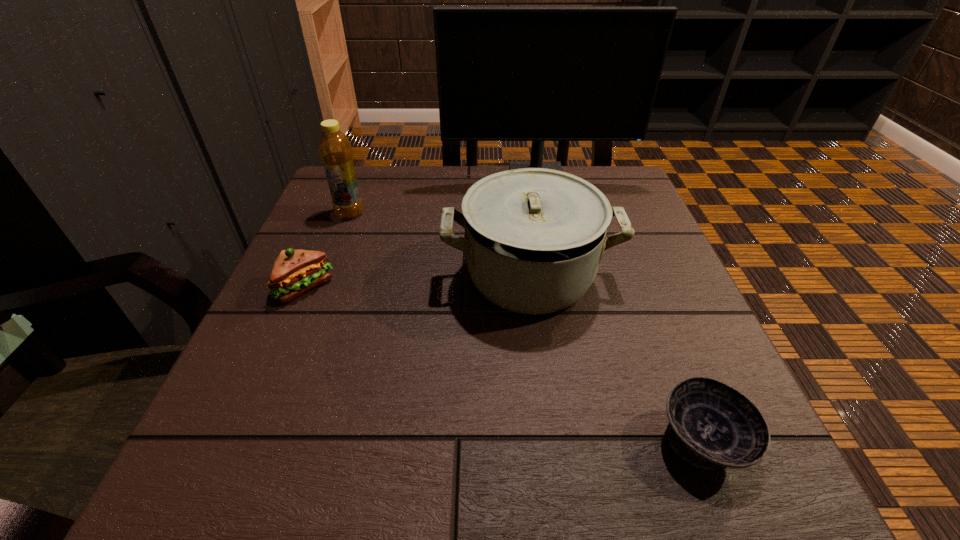
This screenshot has width=960, height=540. Find the location of `free space located 0.270m on the left of the third shortest object`. free space located 0.270m on the left of the third shortest object is located at coordinates (309, 276).

Where is `vacant area located on the back of the sandwich`? vacant area located on the back of the sandwich is located at coordinates (349, 183).

At what (x,y) coordinates should I click in order to perform the action: click on vacant space located 0.090m on the back of the nearest object. Please return your answer as a coordinate pair (x, y). Looking at the image, I should click on (668, 354).

Where is `computer monitor that is at the far edge`? This screenshot has width=960, height=540. computer monitor that is at the far edge is located at coordinates pyautogui.click(x=538, y=74).

What are the coordinates of `bottle that is positioned at the far edge` in the screenshot? It's located at (335, 150).

Where is `object that is at the near edge`? This screenshot has height=540, width=960. object that is at the near edge is located at coordinates (711, 425).

You are a GUI agent. You are given a task and a screenshot of the screen. Output one action in this format:
    pyautogui.click(x=<x>, y=<y>)
    Task: Click on the bottle that is at the left edge
    This screenshot has height=540, width=960.
    Given the screenshot: What is the action you would take?
    pyautogui.click(x=335, y=150)

You are a GUI agent. You are given a task and a screenshot of the screen. Output one action in this format:
    pyautogui.click(x=<x>, y=<y>)
    Task: Click on the sandwich located at the left edge
    This screenshot has width=960, height=540.
    Given the screenshot: What is the action you would take?
    pyautogui.click(x=294, y=272)

You are a GUI agent. You are given a task and a screenshot of the screen. Output one action in this format:
    pyautogui.click(x=<x>, y=<y>)
    Task: Click on the computer monitor located at the right edge
    The image size is (960, 540).
    Given the screenshot: What is the action you would take?
    pyautogui.click(x=538, y=74)

Identify the location of saucepan positioned at the right edge. The image size is (960, 540). (534, 237).